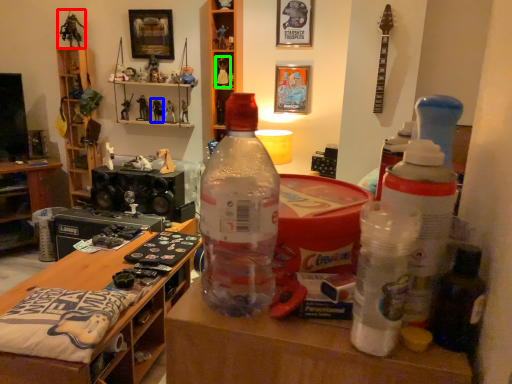
Question: Estimate the real-world distances between objects in this image. Which object is closer to toy (highlighted by a red box), toy (highlighted by a blue box) or toy (highlighted by a green box)?

Choices:
 (A) toy
 (B) toy

Answer: (A)